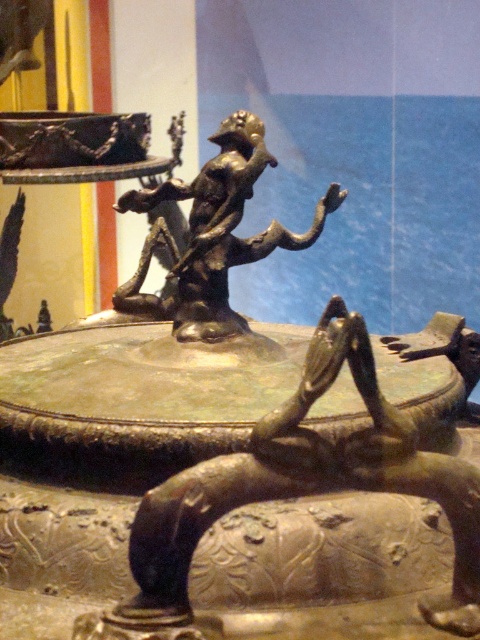
Is point (211, 458) farther from viewer compared to point (335, 202)?

No, it is not.

From the picture: Who is lower down, bronze statue at center or gold-bronze statue at center?

bronze statue at center is lower down.

The image size is (480, 640). What are the coordinates of `bronze statue at center` in the screenshot? It's located at (297, 492).